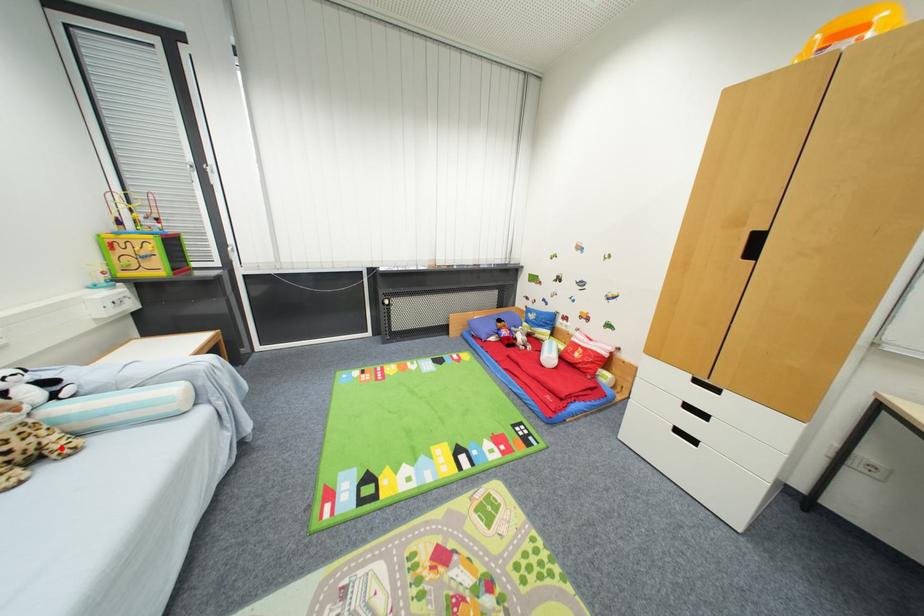
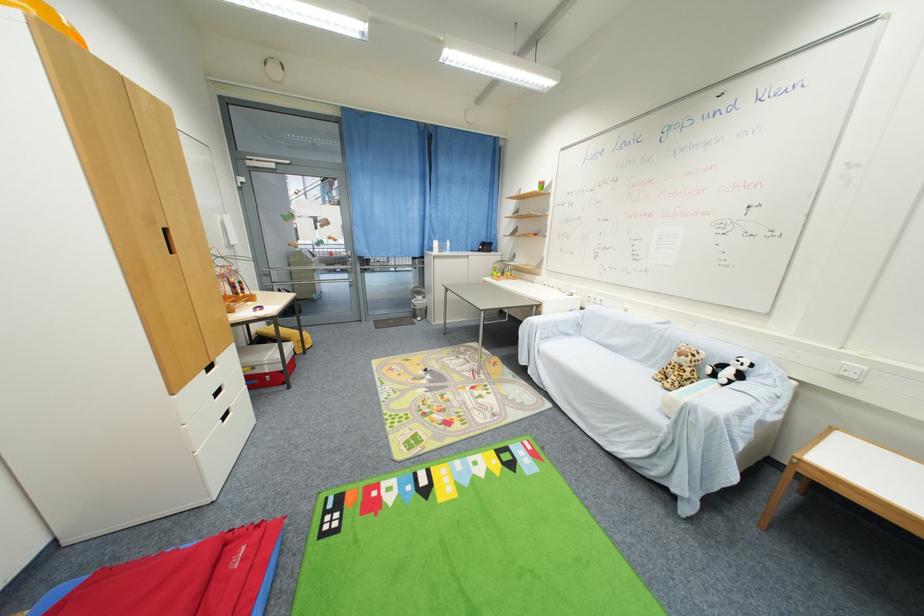
The point at the highlighted location is marked in the first image. Where is the corresponding point in the second image?

(675, 382)